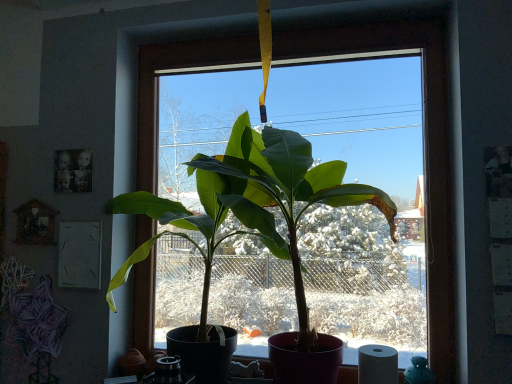
You are a GUI agent. You are given a task and a screenshot of the screen. Output one action in this format:
    pyautogui.click(x=<x>, y=<y>)
    Task: Click on the green matte plant at center
    The height and width of the screenshot is (384, 512).
    Given the screenshot: What is the action you would take?
    pyautogui.click(x=252, y=207)

Measure the distance between point (x=285, y=356) and camera.

The depth of point (x=285, y=356) is 1.59 meters.

From the picture: What is the approximate width of green matte plant at center?

green matte plant at center is 27.09 inches in width.

Describe the element at coordinates (252, 207) in the screenshot. The height and width of the screenshot is (384, 512). I see `green matte plant at center` at that location.

At what (x,y) coordinates should I click in order to perform the action: click on white matte toilet paper at lower right. Please return your answer as a coordinate pair (x, y). The image size is (512, 384). Looking at the image, I should click on (377, 364).

Measure the distance between white matte toilet paper at lower right and camera.

The depth of white matte toilet paper at lower right is 1.53 meters.

Describe the element at coordinates (377, 364) in the screenshot. I see `white matte toilet paper at lower right` at that location.

The height and width of the screenshot is (384, 512). I want to click on green matte plant at center, so click(x=252, y=207).

Does white matte toilet paper at lower right appear on the right side of green matte plant at center?

Indeed, white matte toilet paper at lower right is positioned on the right side of green matte plant at center.

Who is more distant, white matte toilet paper at lower right or green matte plant at center?

white matte toilet paper at lower right is behind.

Is point (394, 379) positioned after point (262, 137)?

No, (394, 379) is closer to viewer.

From the image's perspective, between white matte toilet paper at lower right and green matte plant at center, who is located below?

white matte toilet paper at lower right is shown below in the image.

From a real-world perspective, relative to green matte plant at center, is white matte toilet paper at lower right vertically above or below?

From a real-world perspective, white matte toilet paper at lower right is physically below green matte plant at center.

Considering the relative sizes of white matte toilet paper at lower right and green matte plant at center in the image provided, is white matte toilet paper at lower right thinner than green matte plant at center?

Correct, the width of white matte toilet paper at lower right is less than that of green matte plant at center.

Considering the sizes of white matte toilet paper at lower right and green matte plant at center in the image, is white matte toilet paper at lower right taller or shorter than green matte plant at center?

Considering their sizes, white matte toilet paper at lower right has less height than green matte plant at center.

Considering the sizes of white matte toilet paper at lower right and green matte plant at center in the image, is white matte toilet paper at lower right bigger or smaller than green matte plant at center?

In the image, white matte toilet paper at lower right appears to be smaller than green matte plant at center.

From the picture: Can we say white matte toilet paper at lower right lies outside green matte plant at center?

Actually, white matte toilet paper at lower right is at least partially inside green matte plant at center.

Is white matte toilet paper at lower right far away from green matte plant at center?

No, white matte toilet paper at lower right is in close proximity to green matte plant at center.

Is white matte toilet paper at lower right facing towards green matte plant at center?

Yes.

What's the angular difference between white matte toilet paper at lower right and green matte plant at center's facing directions?

There is a 4.41-degree angle between the facing directions of white matte toilet paper at lower right and green matte plant at center.

Identify the location of houseplant in front of the white matte toilet paper at lower right. (252, 207).

Considering the relative positions of green matte plant at center and white matte toilet paper at lower right in the image provided, is green matte plant at center to the right of white matte toilet paper at lower right from the viewer's perspective?

In fact, green matte plant at center is to the left of white matte toilet paper at lower right.

Who is more distant, green matte plant at center or white matte toilet paper at lower right?

white matte toilet paper at lower right is behind.

Does point (319, 168) come in front of point (394, 348)?

No, (319, 168) is behind (394, 348).

From the image's perspective, is green matte plant at center above or below white matte toilet paper at lower right?

Based on their image positions, green matte plant at center is located above white matte toilet paper at lower right.

From a real-world perspective, does green matte plant at center stand above white matte toilet paper at lower right?

Yes, from a real-world perspective, green matte plant at center is above white matte toilet paper at lower right.

Which object is wider, green matte plant at center or white matte toilet paper at lower right?

green matte plant at center is wider.

Does green matte plant at center have a lesser height compared to white matte toilet paper at lower right?

No, green matte plant at center is not shorter than white matte toilet paper at lower right.

Which of these two, green matte plant at center or white matte toilet paper at lower right, is bigger?

Bigger between the two is green matte plant at center.

Is white matte toilet paper at lower right inside green matte plant at center?

Yes, green matte plant at center is surrounding white matte toilet paper at lower right.

Is green matte plant at center not close to white matte toilet paper at lower right?

No, green matte plant at center is in close proximity to white matte toilet paper at lower right.

Is green matte plant at center facing away from white matte toilet paper at lower right?

Correct, green matte plant at center is looking away from white matte toilet paper at lower right.

What's the angular difference between green matte plant at center and white matte toilet paper at lower right's facing directions?

4.41 degrees separate the facing orientations of green matte plant at center and white matte toilet paper at lower right.

Measure the distance between green matte plant at center and white matte toilet paper at lower right.

green matte plant at center and white matte toilet paper at lower right are 64.76 centimeters apart from each other.

Locate an element on the screen. The image size is (512, 384). toilet paper on the right of the green matte plant at center is located at coordinates (377, 364).

Find the location of `houseplant lying on the left of white matte toilet paper at lower right`. houseplant lying on the left of white matte toilet paper at lower right is located at coordinates (252, 207).

Where is `houseplant above the white matte toilet paper at lower right (from the image's perspective)`? houseplant above the white matte toilet paper at lower right (from the image's perspective) is located at coordinates (252, 207).